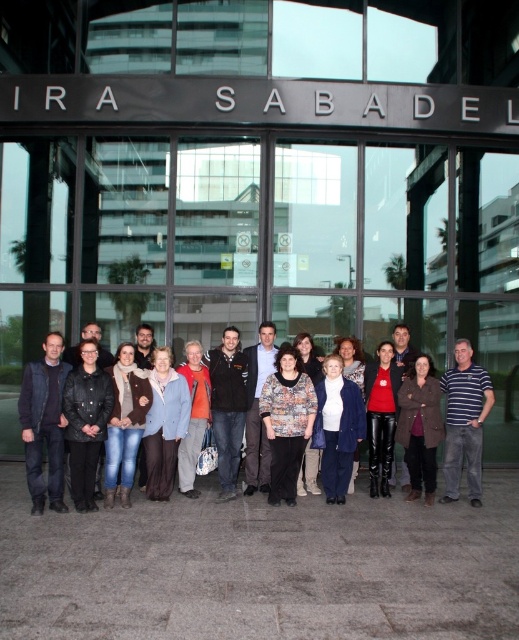
Question: Does printed fabric jacket at center have a larger size compared to light blue fabric coat at center?

Choices:
 (A) yes
 (B) no

Answer: (A)

Question: Based on their relative distances, which object is farther from the printed fabric jacket at center?

Choices:
 (A) denim jacket at center
 (B) dark gray sweater at center

Answer: (A)

Question: Does matte blue coat at center have a smaller size compared to brown leather jacket at center?

Choices:
 (A) no
 (B) yes

Answer: (B)

Question: Which object is farther from the camera taking this photo?

Choices:
 (A) floral-patterned sweater at center
 (B) dark gray sweater at center

Answer: (A)

Question: Is dark blue sweater at left to the right of matte blue coat at center from the viewer's perspective?

Choices:
 (A) no
 (B) yes

Answer: (A)

Question: Which object is positioned closest to the light blue fabric coat at center?

Choices:
 (A) matte blue coat at center
 (B) dark gray sweater at center
 (C) brown leather jacket at center

Answer: (B)